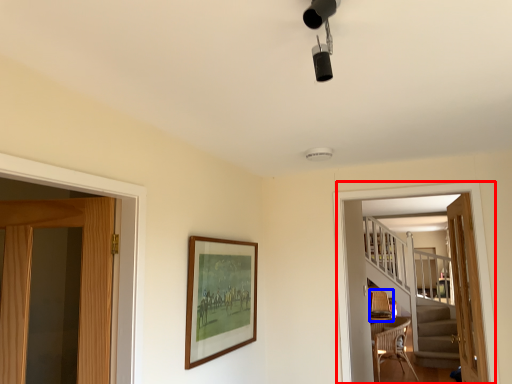
Question: Which of the following is the farthest to the observer, screen door (highlighted by a red box) or armchair (highlighted by a blue box)?

Choices:
 (A) screen door
 (B) armchair

Answer: (B)